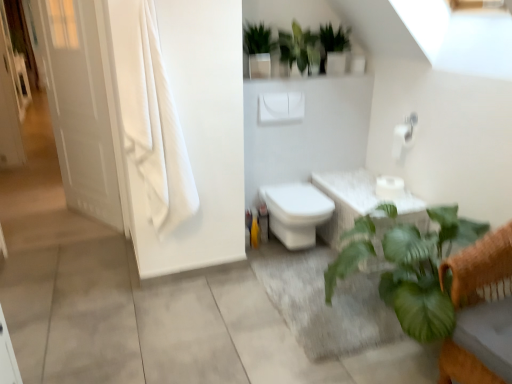
This screenshot has height=384, width=512. I want to click on free space below white matte toilet paper at center, the first toilet paper ordered from the bottom (from a real-world perspective), so click(389, 195).